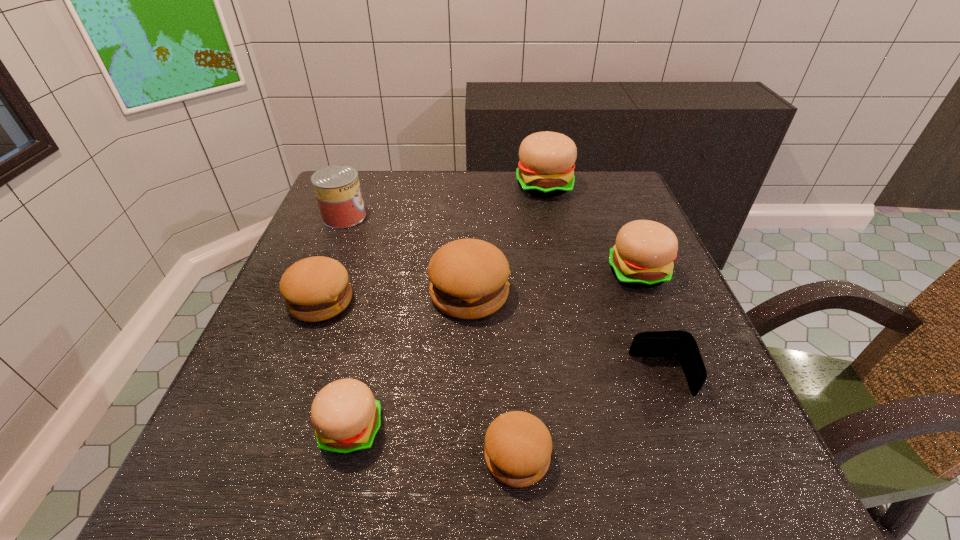
Where is `vacant space located 0.180m on the outer surface of the wallet`? The image size is (960, 540). vacant space located 0.180m on the outer surface of the wallet is located at coordinates (529, 376).

Locate an element on the screen. The width and height of the screenshot is (960, 540). free region located on the outer surface of the wallet is located at coordinates [x=587, y=376].

Find the location of a particular element. This screenshot has height=540, width=960. blank space located on the back of the nearest brown hamburger is located at coordinates (506, 290).

The height and width of the screenshot is (540, 960). I want to click on hamburger present at the far edge, so click(x=546, y=168).

Locate an element on the screen. This screenshot has height=540, width=960. can situated at the far edge is located at coordinates (337, 188).

Identify the location of can at the left edge. This screenshot has height=540, width=960. (337, 188).

Identify the location of hamburger at the left edge. The height and width of the screenshot is (540, 960). [316, 288].

Identify the location of wallet that is at the right edge. coord(681,344).

I want to click on object located at the far left corner, so click(x=337, y=188).

Find the location of a particular element. This screenshot has height=540, width=960. object positioned at the far right corner is located at coordinates (546, 168).